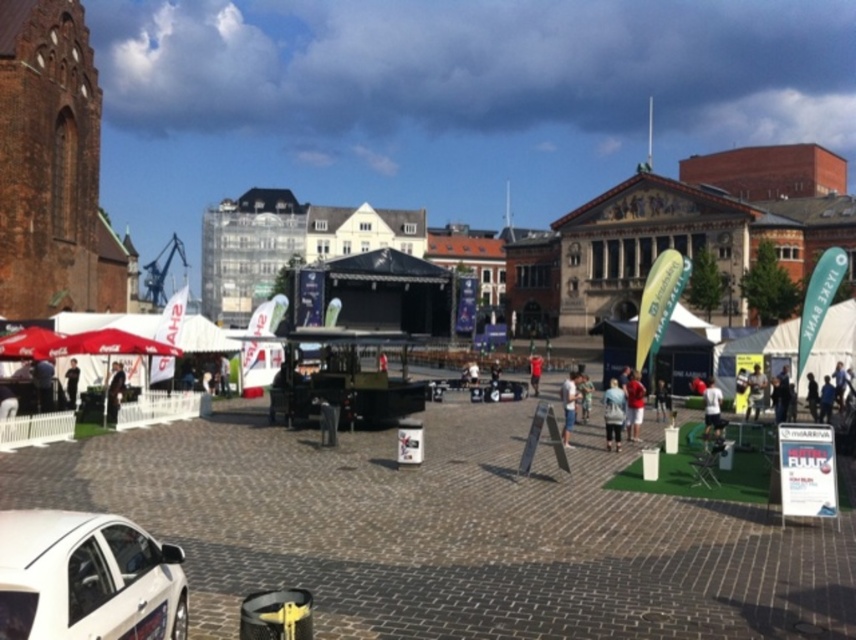
In the scene, there is a white car parked on the left side and a stage with a black canopy in the center. A point labeled as point (634, 404) is also present. Which object is closer to the stage with a black canopy in the center?

The point (634, 404) is closer to the stage with a black canopy in the center than the white car parked on the left side.

Based on the photo, you are a photographer standing in the cobblestone pavement in the foreground of the plaza. You want to take a photo of the stage with black canopy in the center without any obstructions. The white matte car at lower left and dark blue jeans at left are in your way. Which object should you move to ensure a clear view of the stage?

The white matte car at lower left has a lesser height compared to dark blue jeans at left. Therefore, you should move the white matte car at lower left to ensure a clear view of the stage with black canopy in the center since it is shorter and less likely to obstruct the view.

Looking at this image, you are a photographer positioned at the edge of the cobblestone pavement. You want to capture both the matte red shirt at center and the brown leather jacket at center in a single frame. Given that your camera has a maximum focal length that allows a 10 feet field of view, will you be able to include both subjects in the photo?

The matte red shirt at center and the brown leather jacket at center are 32.66 feet apart, which exceeds the camera field of view of 10 feet. Therefore, you cannot capture both in a single frame.